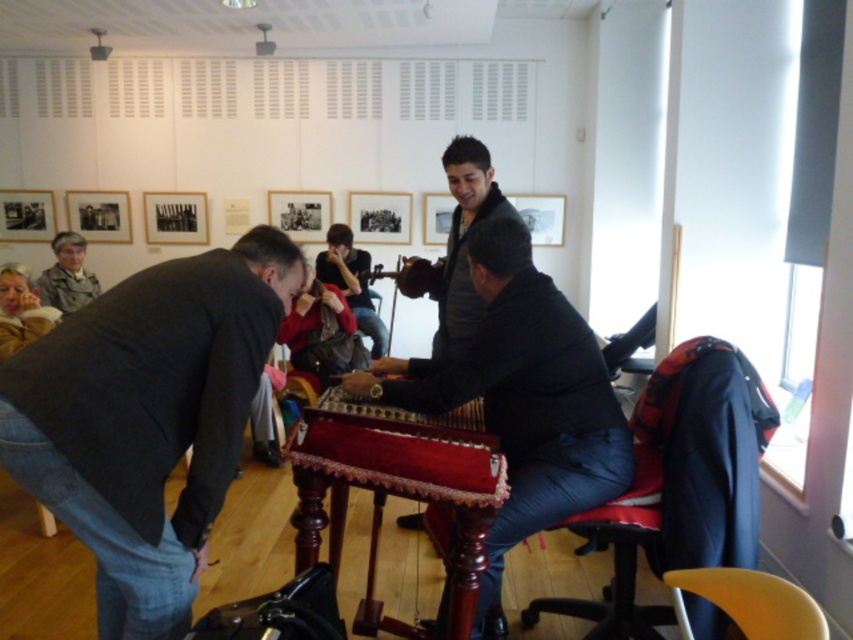
You are a visitor in the art gallery and want to sit down on the red fabric chair at lower right to rest. However, there is a black matte picture frame at upper left hanging above the chair. Considering their heights, do you think the chair will hit your head when you sit?

The red fabric chair at lower right is much taller than the black matte picture frame at upper left. Since the chair is taller, when you sit on it, your head might hit the frame above, so it might not be safe to sit there.

You are an art curator standing in the center of the gallery. You need to move the dark gray sweater at center and the wooden acoustic guitar at center to the left side of the table. Which object should you move first to ensure the guitar remains visible from the entrance?

The dark gray sweater at center is to the right of the wooden acoustic guitar at center. Move the dark gray sweater at center first so that the wooden acoustic guitar at center stays visible on the left side of the table.